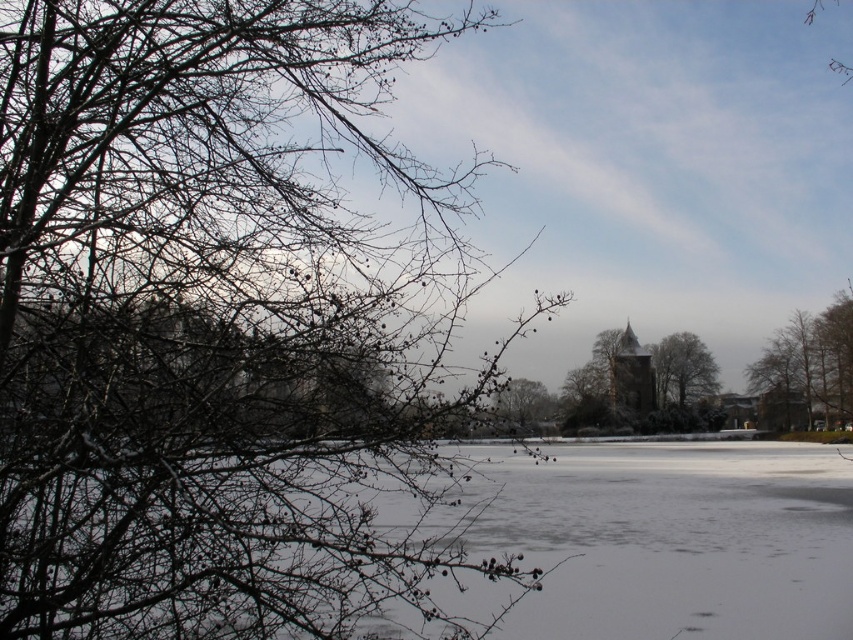
Can you confirm if snow-covered branches at left is wider than green leafy tree at right?

Correct, the width of snow-covered branches at left exceeds that of green leafy tree at right.

Locate an element on the screen. The width and height of the screenshot is (853, 640). snow-covered branches at left is located at coordinates (215, 323).

Does point (457, 19) come in front of point (839, 397)?

Yes, point (457, 19) is closer to viewer.

Locate an element on the screen. snow-covered branches at left is located at coordinates (215, 323).

Who is more forward, (32, 266) or (680, 349)?

Point (32, 266) is in front.

Measure the distance between point (279, 387) and camera.

Point (279, 387) is 5.92 meters away from camera.

Locate an element on the screen. Image resolution: width=853 pixels, height=640 pixels. snow-covered branches at left is located at coordinates (215, 323).

Which of these two, snow-covered branches at left or smooth brown tree at center, stands taller?

Standing taller between the two is snow-covered branches at left.

Who is lower down, snow-covered branches at left or smooth brown tree at center?

smooth brown tree at center

Who is more distant from viewer, (482, 26) or (515, 426)?

The point (515, 426) is more distant.

Where is `snow-covered branches at left`? The image size is (853, 640). snow-covered branches at left is located at coordinates (215, 323).